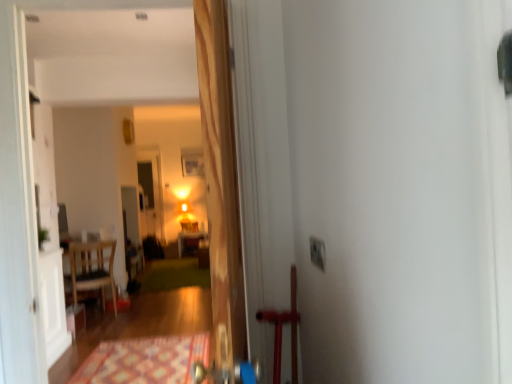
Question: From a real-world perspective, is wooden chair at left over white plastic electric outlet at upper right?

Choices:
 (A) no
 (B) yes

Answer: (A)

Question: Is wooden chair at left in front of white plastic electric outlet at upper right?

Choices:
 (A) yes
 (B) no

Answer: (B)

Question: Is wooden chair at left next to white plastic electric outlet at upper right and touching it?

Choices:
 (A) yes
 (B) no

Answer: (B)

Question: From the image's perspective, is wooden chair at left located beneath white plastic electric outlet at upper right?

Choices:
 (A) no
 (B) yes

Answer: (B)

Question: From the image's perspective, is wooden chair at left on top of white plastic electric outlet at upper right?

Choices:
 (A) yes
 (B) no

Answer: (B)

Question: Is patterned carpet at lower center, which appears as the first doormat when viewed from the front, in front of or behind wooden chair at left in the image?

Choices:
 (A) behind
 (B) front

Answer: (B)

Question: Looking at the image, does patterned carpet at lower center, which appears as the first doormat when viewed from the front, seem bigger or smaller compared to wooden chair at left?

Choices:
 (A) small
 (B) big

Answer: (A)

Question: From a real-world perspective, is patterned carpet at lower center, which ranks as the 2th doormat in back-to-front order, positioned above or below wooden chair at left?

Choices:
 (A) below
 (B) above

Answer: (A)

Question: Looking at their shapes, would you say patterned carpet at lower center, which ranks as the 2th doormat in back-to-front order, is wider or thinner than wooden chair at left?

Choices:
 (A) thin
 (B) wide

Answer: (B)

Question: Considering the positions of wooden table at center and patterned carpet at lower center, which ranks as the 2th doormat in back-to-front order, in the image, is wooden table at center wider or thinner than patterned carpet at lower center, which ranks as the 2th doormat in back-to-front order,?

Choices:
 (A) wide
 (B) thin

Answer: (B)

Question: Would you say wooden table at center is inside or outside patterned carpet at lower center, which appears as the first doormat when viewed from the front?

Choices:
 (A) outside
 (B) inside

Answer: (A)

Question: Considering their positions, is wooden table at center located in front of or behind patterned carpet at lower center, which ranks as the 2th doormat in back-to-front order?

Choices:
 (A) behind
 (B) front

Answer: (A)

Question: Based on their positions, is wooden table at center located to the left or right of patterned carpet at lower center, which appears as the first doormat when viewed from the front?

Choices:
 (A) left
 (B) right

Answer: (A)

Question: Is white plastic electric outlet at upper right inside the boundaries of wooden chair at left, or outside?

Choices:
 (A) outside
 (B) inside

Answer: (A)

Question: Based on their sizes in the image, would you say white plastic electric outlet at upper right is bigger or smaller than wooden chair at left?

Choices:
 (A) small
 (B) big

Answer: (A)